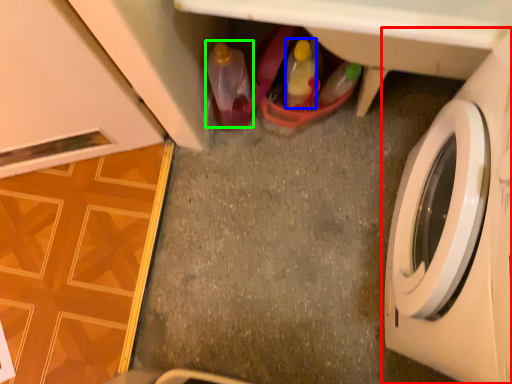
Question: Which object is positioned closest to washing machine (highlighted by a red box)? Select from bottle (highlighted by a blue box) and bottle (highlighted by a green box).

Choices:
 (A) bottle
 (B) bottle

Answer: (A)